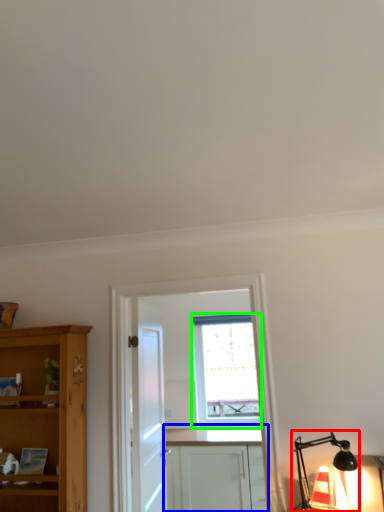
Question: Which is nearer to the light fixture (highlighted by a red box)? cabinetry (highlighted by a blue box) or window (highlighted by a green box).

Choices:
 (A) cabinetry
 (B) window

Answer: (A)